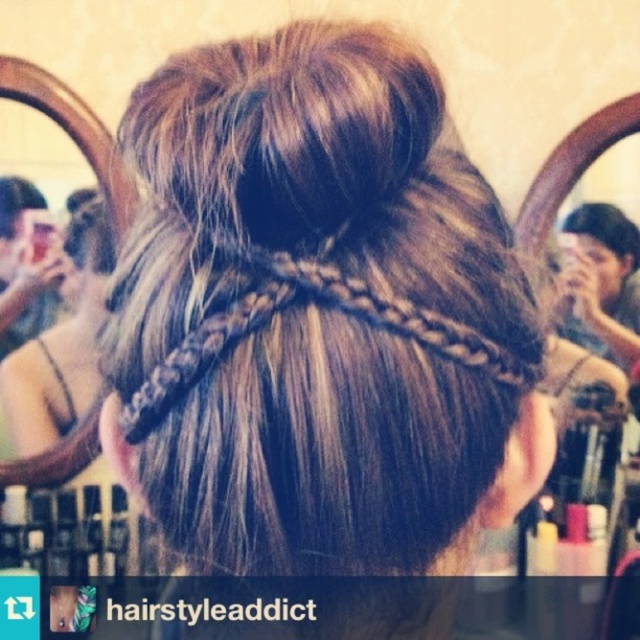
You are standing in front of the person in the image. There are two points marked in the scene. Which of the two points, point (320, 198) or point (10, 237), is closer to you?

Point (320, 198) is closer to the camera than point (10, 237), so it is closer to you.